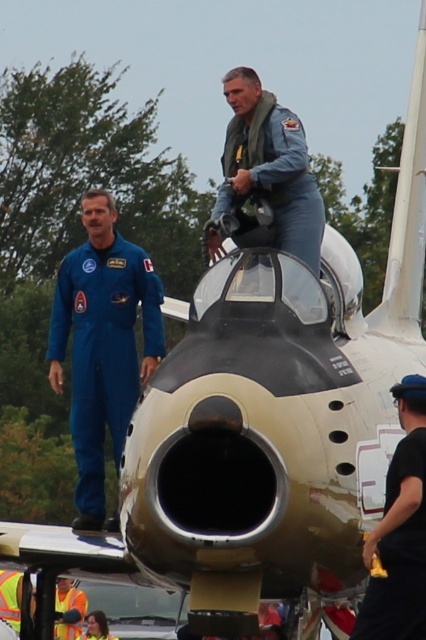
Question: Which object appears farthest from the camera in this image?

Choices:
 (A) blue denim jumpsuit at center
 (B) blue smooth jumpsuit at left

Answer: (B)

Question: Which object appears farthest from the camera in this image?

Choices:
 (A) blue smooth jumpsuit at left
 (B) black matte helmet at upper center

Answer: (A)

Question: Is blue denim jumpsuit at center above black matte helmet at upper center?

Choices:
 (A) no
 (B) yes

Answer: (B)

Question: Does blue smooth jumpsuit at left have a greater width compared to high visibility vest at lower left?

Choices:
 (A) yes
 (B) no

Answer: (A)

Question: Which point is farther from the camera taking this photo?

Choices:
 (A) (85, 609)
 (B) (362, 625)

Answer: (A)

Question: Can you confirm if blue smooth jumpsuit at left is positioned to the right of black matte helmet at upper center?

Choices:
 (A) no
 (B) yes

Answer: (A)